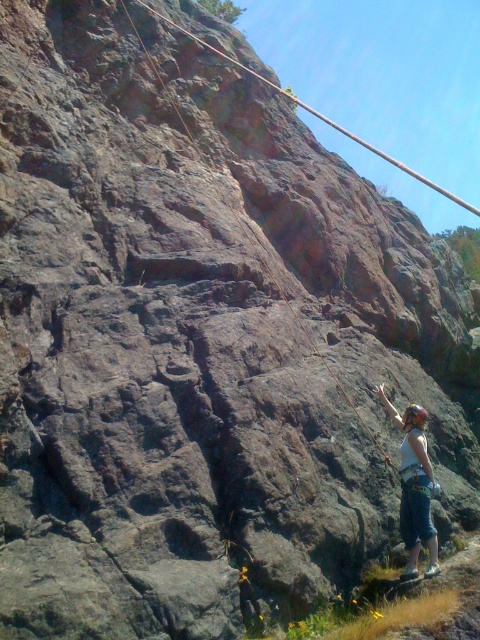
Question: Which of the following is the farthest from the observer?

Choices:
 (A) (135, 36)
 (B) (394, 410)

Answer: (A)

Question: Does white fabric helmet at right have a greater width compared to rusty rock climbing hold at center?

Choices:
 (A) no
 (B) yes

Answer: (B)

Question: Can you confirm if white fabric helmet at right is smaller than rusty rock climbing hold at center?

Choices:
 (A) no
 (B) yes

Answer: (A)

Question: Does white fabric helmet at right lie in front of rusty rock climbing hold at center?

Choices:
 (A) no
 (B) yes

Answer: (B)